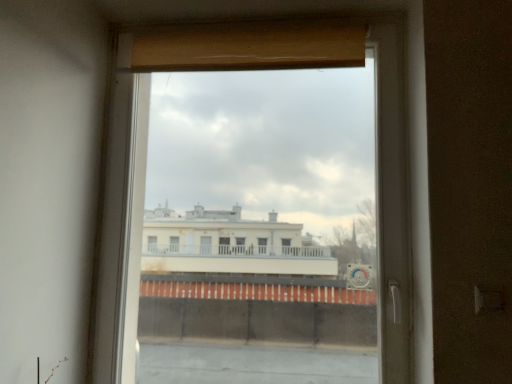
Image resolution: width=512 pixels, height=384 pixels. Find the location of `transparent glass window at center`. transparent glass window at center is located at coordinates (397, 197).

What do you see at coordinates (397, 197) in the screenshot? This screenshot has width=512, height=384. I see `transparent glass window at center` at bounding box center [397, 197].

Measure the distance between point (138, 262) and camera.

The depth of point (138, 262) is 6.30 feet.

The width and height of the screenshot is (512, 384). I want to click on transparent glass window at center, so click(x=397, y=197).